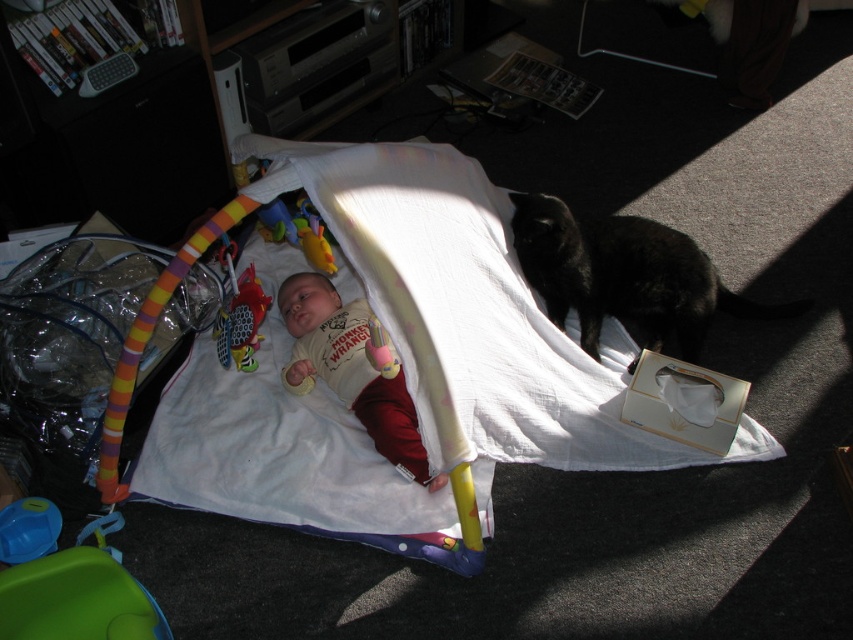
You are a parent trying to clean up the play area. You see the white soft fabric at center and the rubberized plastic toy at center. Which object should you pick up first if you want to start cleaning from the left side of the play mat?

You should pick up the rubberized plastic toy at center first because the white soft fabric at center is to the right of it, so the rubberized plastic toy at center is on the left side.

You are a babysitter watching the baby. You notice the white soft baby at center and the rubberized plastic toy at center. Which object is directly above the other?

The white soft baby at center is positioned under the rubberized plastic toy at center, so the rubberized plastic toy at center is directly above the white soft baby at center.

You are a photographer taking a picture of the baby in the play mat. You need to focus on two points in the scene, point A at point (376, 387) and point B at point (223, 358). Which point should you focus on to ensure the baby is in focus?

Point A at point (376, 387) is closer to the camera than point B at point (223, 358). Therefore, focusing on point A would ensure the baby is in focus since it is closer to the camera.